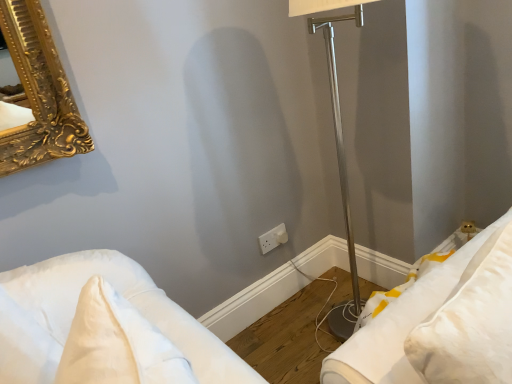
Question: From a real-world perspective, is white soft pillow at lower left, the second furniture when ordered from right to left, physically located above or below white plastic electric outlet at center?

Choices:
 (A) below
 (B) above

Answer: (B)

Question: Visually, is white soft pillow at lower left, marked as the 1th furniture in a left-to-right arrangement, positioned to the left or to the right of white plastic electric outlet at center?

Choices:
 (A) left
 (B) right

Answer: (A)

Question: Based on their relative distances, which object is farther from the white plastic electric outlet at center?

Choices:
 (A) white soft pillow at lower left, marked as the 1th furniture in a left-to-right arrangement
 (B) white fabric pillow at lower right, the 2th furniture from the left

Answer: (B)

Question: Which of these objects is positioned farthest from the white soft pillow at lower left, marked as the 1th furniture in a left-to-right arrangement?

Choices:
 (A) white plastic electric outlet at center
 (B) white fabric pillow at lower right, the 2th furniture from the left

Answer: (A)